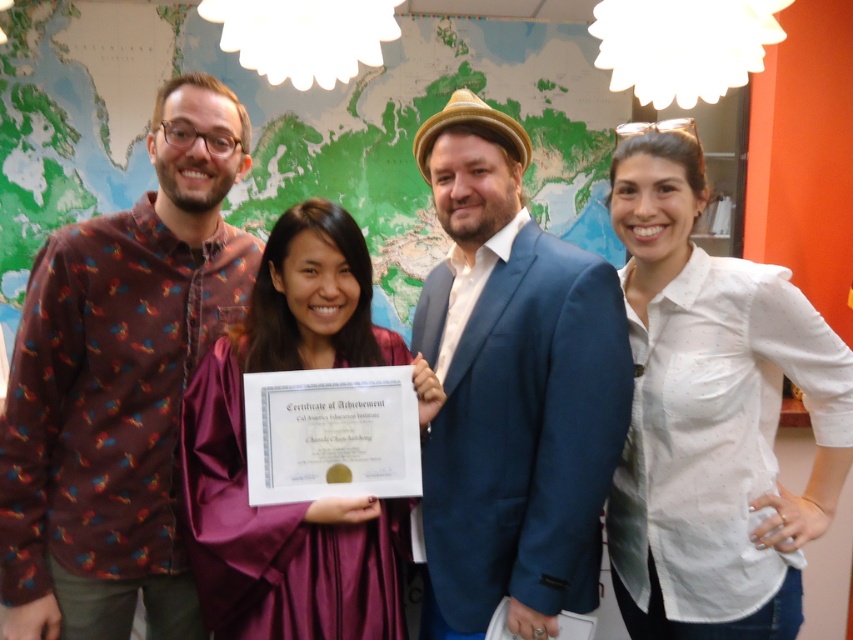
At what (x,y) coordinates should I click in order to perform the action: click on blue fabric suit at center. Please return your answer as a coordinate pair (x, y). Image resolution: width=853 pixels, height=640 pixels. Looking at the image, I should click on (511, 390).

Which of these two, blue fabric suit at center or white paper certificate at center, stands shorter?

white paper certificate at center is shorter.

Who is more forward, (572, 264) or (265, 432)?

Point (572, 264) is more forward.

Image resolution: width=853 pixels, height=640 pixels. What are the coordinates of `blue fabric suit at center` in the screenshot? It's located at (511, 390).

Does blue fabric suit at center have a larger size compared to white dotted shirt at right?

Yes.

Describe the element at coordinates (511, 390) in the screenshot. I see `blue fabric suit at center` at that location.

Is point (514, 452) in front of point (664, 380)?

Yes, it is in front of point (664, 380).

Find the location of a particular element. This screenshot has width=853, height=640. blue fabric suit at center is located at coordinates (511, 390).

Between point (74, 268) and point (335, 496), which one is positioned behind?

Point (74, 268)

Is brown printed shirt at left below white paper certificate at center?

No, brown printed shirt at left is not below white paper certificate at center.

Find the location of a particular element. The width and height of the screenshot is (853, 640). brown printed shirt at left is located at coordinates (120, 385).

What are the coordinates of `brown printed shirt at left` in the screenshot? It's located at (120, 385).